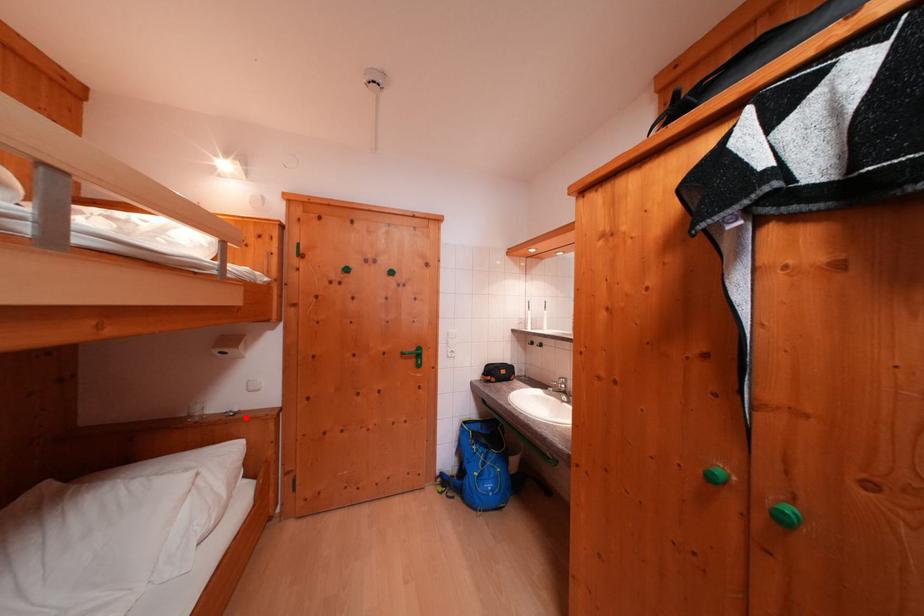
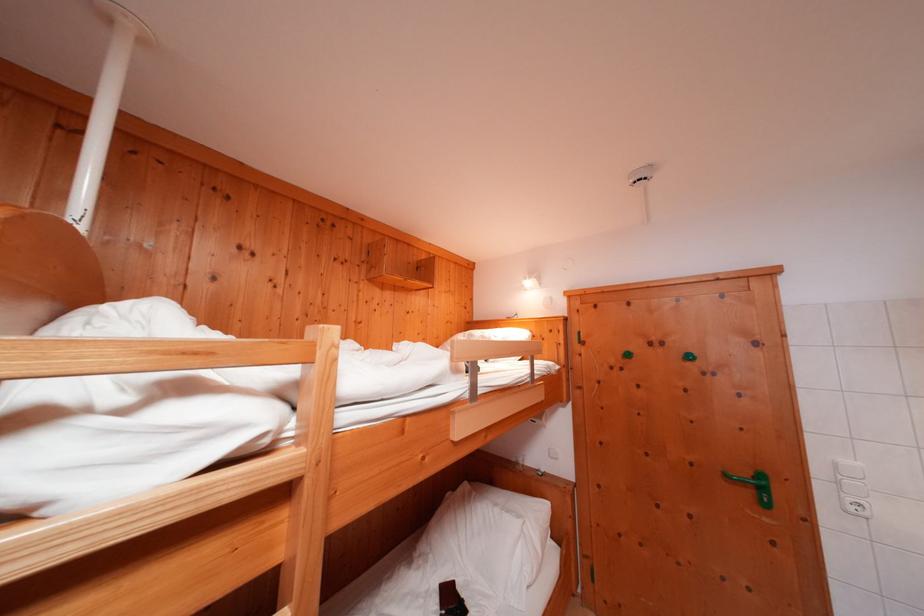
Where in the second image is the point corresponding to the highlighted location from the first image?

(552, 477)